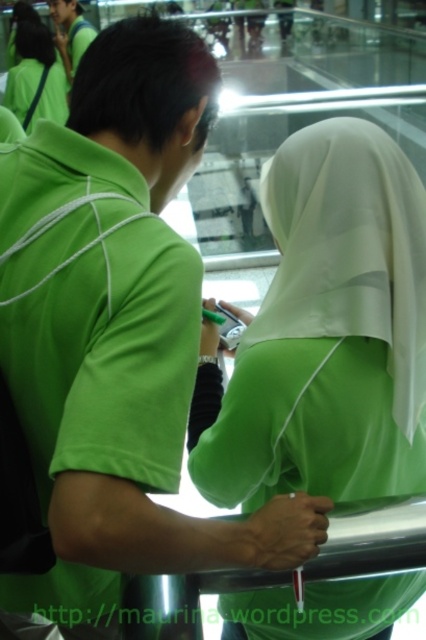
You are an interior designer assessing the layout of a room with two hijabs displayed. The green satin hijab at center and the matte green hijab at upper left are part of a decorative arrangement. Which hijab is positioned lower in the scene?

The green satin hijab at center is positioned lower than the matte green hijab at upper left, as it is located below it.

You are a fashion designer who wants to create a matching outfit using both the green satin hijab at center and the matte green hijab at upper left. Which hijab should you choose as the main piece if you want the wider one to stand out more?

The matte green hijab at upper left should be chosen as the main piece because its width is greater than the green satin hijab at center, allowing it to stand out more when paired together.

You are a security camera analyzing the scene. You need to determine which of the two points, point (32,54) or point (80,33), is closer to the camera. Based on the scene description, which point is closer?

Point (32,54) is closer to the viewer than point (80,33), so the security camera would detect point (32,54) as closer.